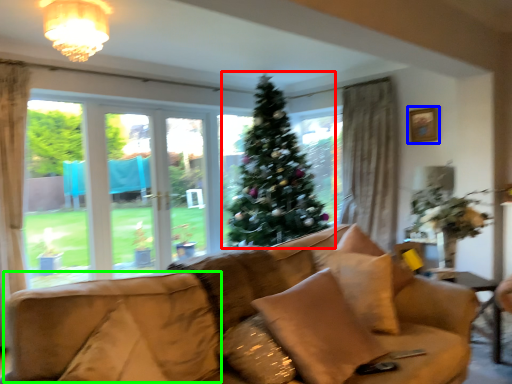
Question: Based on their relative distances, which object is nearer to christmas tree (highlighted by a red box)? Choose from picture frame (highlighted by a blue box) and swivel chair (highlighted by a green box).

Choices:
 (A) picture frame
 (B) swivel chair

Answer: (A)